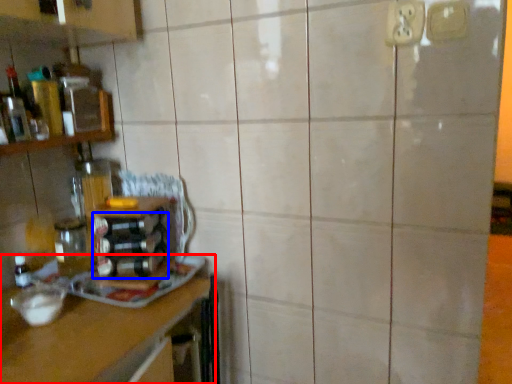
Question: Among these objects, which one is nearest to the camera, countertop (highlighted by a red box) or bottle (highlighted by a blue box)?

Choices:
 (A) countertop
 (B) bottle

Answer: (A)